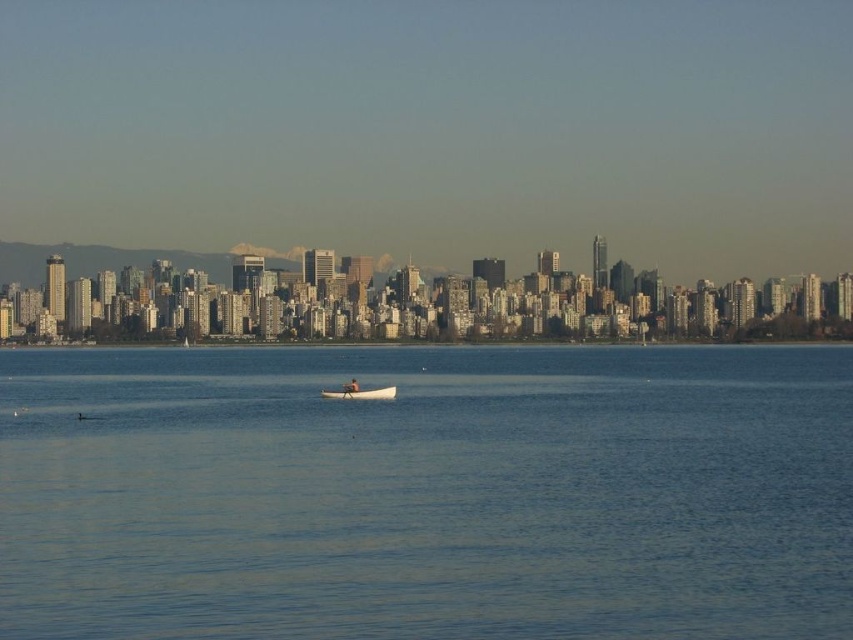
Is point (662, 602) closer to viewer compared to point (328, 388)?

No, (662, 602) is further to viewer.

How much distance is there between clear blue water at center and white wood boat at center?

The distance of clear blue water at center from white wood boat at center is 174.49 feet.

Where is `clear blue water at center`? Image resolution: width=853 pixels, height=640 pixels. clear blue water at center is located at coordinates (426, 493).